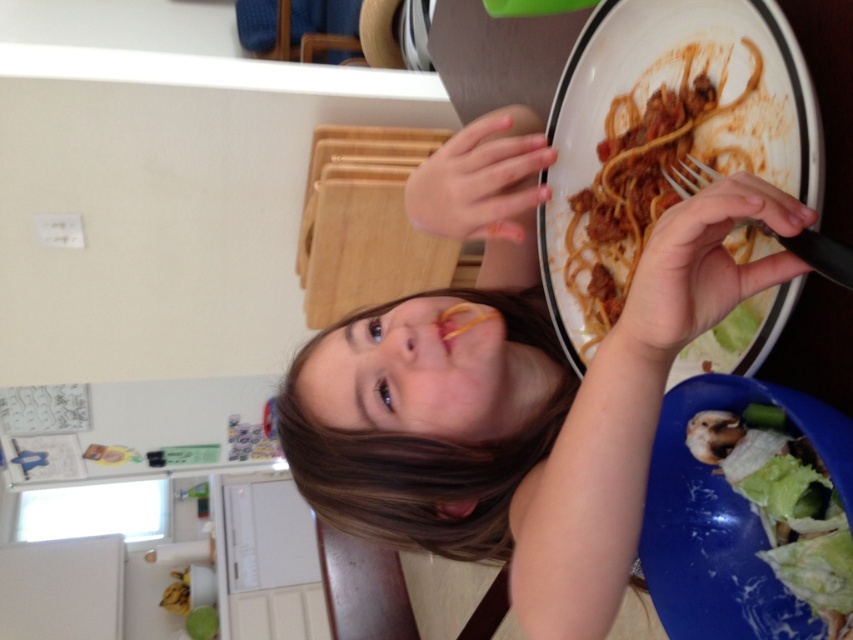
You are standing in the dining area and want to place a small decoration between the two points labeled point (590, 628) and point (695, 99) on the refrigerator. Which point should the decoration be closer to in order to appear larger in the image?

The decoration should be placed closer to point (590, 628) because it is closer to the camera, making objects placed there appear larger in the image.

You are a chef preparing a dish and need to place the green leafy vegetable at lower right and black plastic fork at upper right on a plate. Based on their sizes, which one should you place first to ensure they fit properly?

The green leafy vegetable at lower right might be wider than black plastic fork at upper right, so you should place the green leafy vegetable at lower right first to ensure there is enough space for both items on the plate.